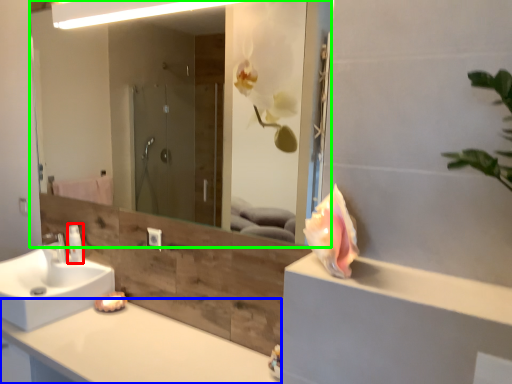
Question: Estimate the real-world distances between objects in this image. Which object is farther from toiletry (highlighted by a red box), countertop (highlighted by a blue box) or mirror (highlighted by a green box)?

Choices:
 (A) countertop
 (B) mirror

Answer: (B)